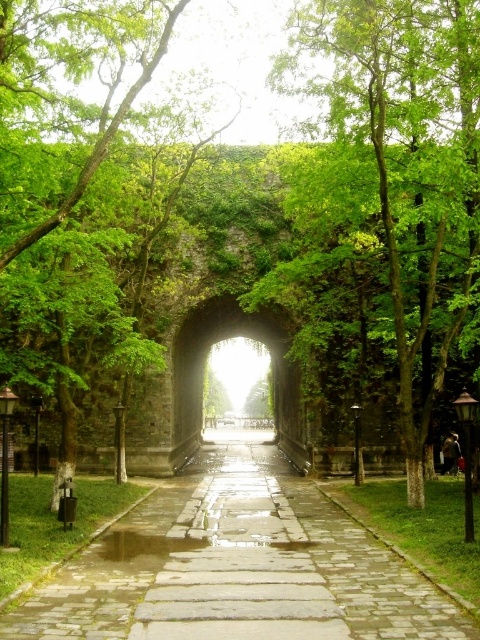
Can you confirm if paved stone path at center is positioned below green stone archway at center?

Correct, paved stone path at center is located below green stone archway at center.

The image size is (480, 640). What are the coordinates of `paved stone path at center` in the screenshot? It's located at (237, 564).

Can you confirm if stone paved path at center is positioned to the left of green stone archway at center?

No, stone paved path at center is not to the left of green stone archway at center.

Is stone paved path at center in front of green stone archway at center?

Yes, it is.

Consider the image. Measure the distance between stone paved path at center and camera.

A distance of 22.29 meters exists between stone paved path at center and camera.

At what (x,y) coordinates should I click in order to perform the action: click on stone paved path at center. Please return your answer as a coordinate pair (x, y). This screenshot has width=480, height=640. Looking at the image, I should click on (239, 564).

Which is above, green leafy tree at center or stone paved path at center?

green leafy tree at center is above.

In the scene shown: Who is more distant from viewer, (424, 349) or (268, 598)?

Positioned behind is point (424, 349).

The width and height of the screenshot is (480, 640). I want to click on green leafy tree at center, so click(x=396, y=177).